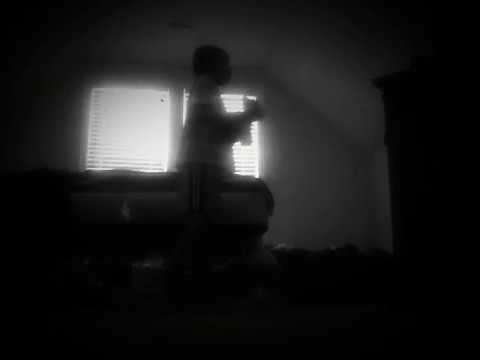
Where is `blanket`? This screenshot has height=360, width=480. blanket is located at coordinates (137, 182).